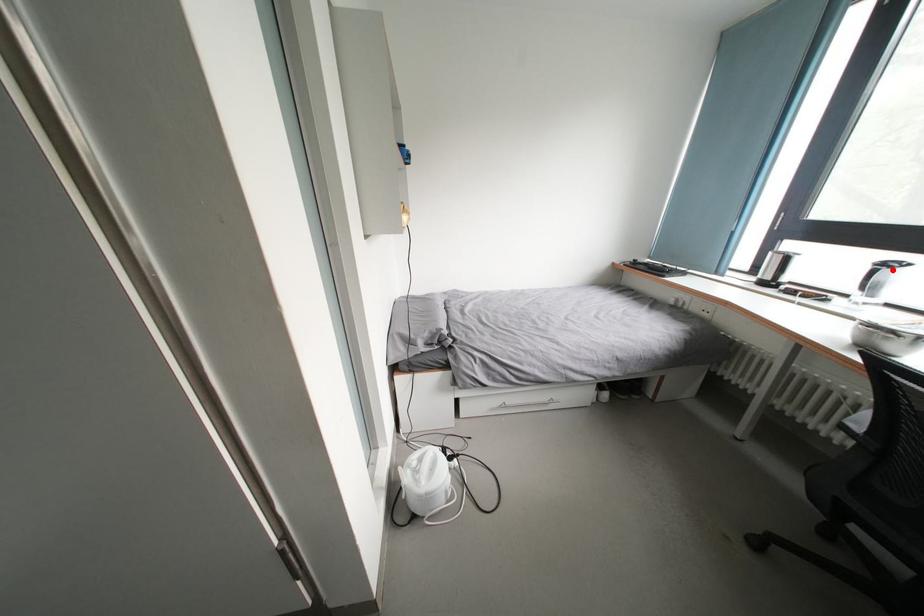
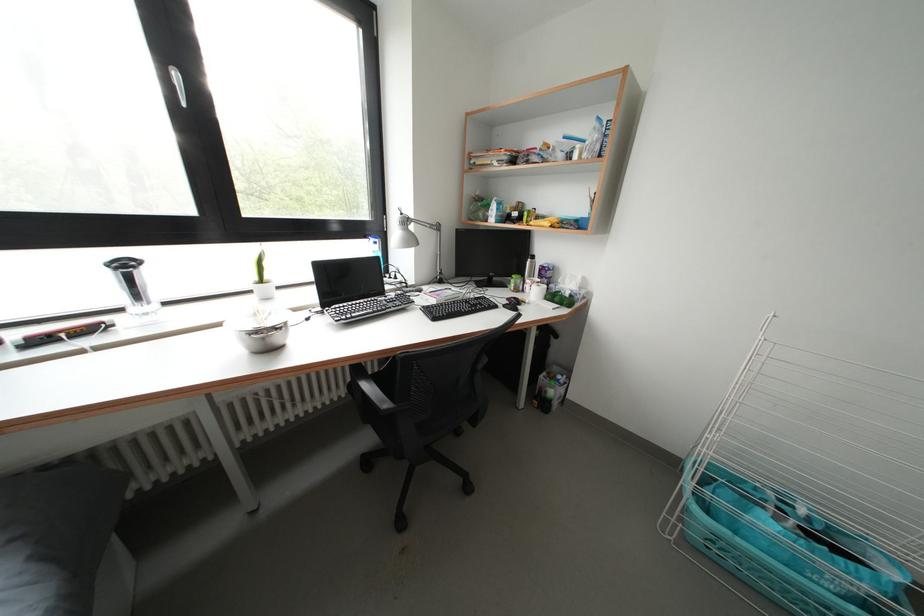
Where in the second image is the point corresponding to the highlighted location from the first image?

(131, 270)